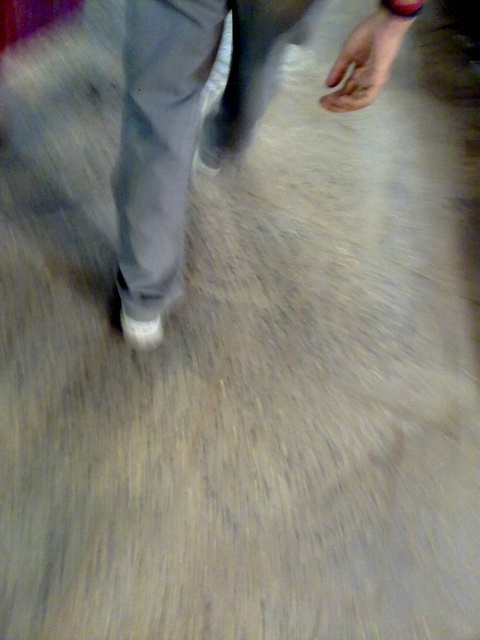
Question: Among these objects, which one is nearest to the camera?

Choices:
 (A) white matte shoe at lower center
 (B) white fabric pants at center

Answer: (B)

Question: Which object appears farthest from the camera in this image?

Choices:
 (A) white fabric pants at center
 (B) white matte shoe at lower center

Answer: (B)

Question: Is white fabric pants at center to the right of white matte shoe at lower center from the viewer's perspective?

Choices:
 (A) no
 (B) yes

Answer: (B)

Question: Does white fabric pants at center appear on the left side of white matte shoe at lower center?

Choices:
 (A) yes
 (B) no

Answer: (B)

Question: Is white fabric pants at center above white matte shoe at lower center?

Choices:
 (A) yes
 (B) no

Answer: (A)